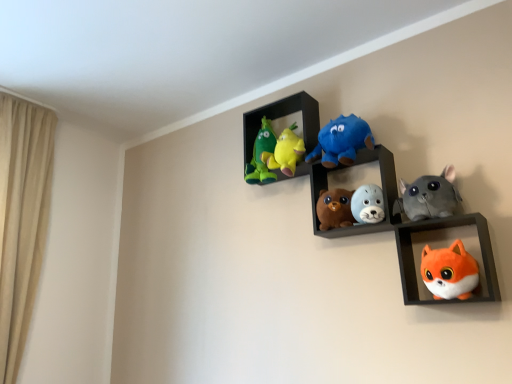
The width and height of the screenshot is (512, 384). I want to click on fluffy gray seal at center, the 3th toy positioned from the right, so click(x=368, y=204).

Identify the location of green plush toy at upper left, the first toy viewed from the left. Image resolution: width=512 pixels, height=384 pixels. (262, 155).

What is the approximate width of blue plush toy at center, which is the fourth toy in right-to-left order?

The width of blue plush toy at center, which is the fourth toy in right-to-left order, is 6.03 inches.

What is the approximate height of soft plush toys at center, arranged as the second shelf when viewed from the front?

soft plush toys at center, arranged as the second shelf when viewed from the front, is 10.71 inches in height.

You are a GUI agent. You are given a task and a screenshot of the screen. Output one action in this format:
    pyautogui.click(x=<x>, y=<y>)
    Task: Click on the velvet plush toys at upper center
    Image resolution: width=512 pixels, height=384 pixels.
    Given the screenshot: What is the action you would take?
    pyautogui.click(x=283, y=116)

Locate an element on the screen. The height and width of the screenshot is (384, 512). gray plush cat at upper right, the 5th toy positioned from the left is located at coordinates (428, 196).

Find the location of a particular element. This screenshot has width=512, height=384. fluffy gray seal at center, placed as the fourth toy when sorted from left to right is located at coordinates 368,204.

Which object is wider, fluffy gray seal at center, the 3th toy positioned from the right, or beige fabric curtain at left?

beige fabric curtain at left.

Is fluffy gray seal at center, placed as the fourth toy when sorted from left to right, oriented towards beige fabric curtain at left?

No, fluffy gray seal at center, placed as the fourth toy when sorted from left to right, is not facing towards beige fabric curtain at left.

Can you confirm if fluffy gray seal at center, the 3th toy positioned from the right, is bigger than beige fabric curtain at left?

Actually, fluffy gray seal at center, the 3th toy positioned from the right, might be smaller than beige fabric curtain at left.

From a real-world perspective, which is physically below, fluffy gray seal at center, the 3th toy positioned from the right, or beige fabric curtain at left?

fluffy gray seal at center, the 3th toy positioned from the right.

Can you confirm if gray plush cat at upper right, which is the second toy from right to left, is shorter than blue plush toy at center, which is the fourth toy in right-to-left order?

Indeed, gray plush cat at upper right, which is the second toy from right to left, has a lesser height compared to blue plush toy at center, which is the fourth toy in right-to-left order.

In the scene shown: Is gray plush cat at upper right, the 5th toy positioned from the left, completely or partially outside of blue plush toy at center, the 3th toy when ordered from left to right?

gray plush cat at upper right, the 5th toy positioned from the left, lies outside blue plush toy at center, the 3th toy when ordered from left to right,'s area.

Which object is closer to the camera, gray plush cat at upper right, which is the second toy from right to left, or blue plush toy at center, the 3th toy when ordered from left to right?

gray plush cat at upper right, which is the second toy from right to left, is closer to the camera.

Is blue plush toy at center, the 3th toy when ordered from left to right, at the back of gray plush cat at upper right, which is the second toy from right to left?

No, gray plush cat at upper right, which is the second toy from right to left,'s orientation is not away from blue plush toy at center, the 3th toy when ordered from left to right.

Between beige fabric curtain at left and brown plush bear at center, which appears as the 2th toy when viewed from the left, which one has less height?

With less height is brown plush bear at center, which appears as the 2th toy when viewed from the left.

Which of these two, beige fabric curtain at left or brown plush bear at center, the fifth toy viewed from the right, is thinner?

brown plush bear at center, the fifth toy viewed from the right.

Does beige fabric curtain at left turn towards brown plush bear at center, the fifth toy viewed from the right?

No, beige fabric curtain at left is not aimed at brown plush bear at center, the fifth toy viewed from the right.

Which toy is the 2nd one when counting from the right side of the beige fabric curtain at left? Please provide its 2D coordinates.

[(334, 209)]

Is velvet plush toys at upper center shorter than fluffy gray seal at center, the 3th toy positioned from the right?

Incorrect, the height of velvet plush toys at upper center does not fall short of that of fluffy gray seal at center, the 3th toy positioned from the right.

Could you tell me if velvet plush toys at upper center is facing fluffy gray seal at center, placed as the fourth toy when sorted from left to right?

No, velvet plush toys at upper center does not turn towards fluffy gray seal at center, placed as the fourth toy when sorted from left to right.

Looking at this image, can you confirm if velvet plush toys at upper center is wider than fluffy gray seal at center, the 3th toy positioned from the right?

Incorrect, the width of velvet plush toys at upper center does not surpass that of fluffy gray seal at center, the 3th toy positioned from the right.

From a real-world perspective, which object rests below the other?

fluffy gray seal at center, the 3th toy positioned from the right, from a real-world perspective.

How many degrees apart are the facing directions of orange plush fox at lower right, the second shelf positioned from the back, and green plush toy at upper left, the first toy viewed from the left?

The facing directions of orange plush fox at lower right, the second shelf positioned from the back, and green plush toy at upper left, the first toy viewed from the left, are 2.18 degrees apart.

Between orange plush fox at lower right, which is the 1th shelf from front to back, and green plush toy at upper left, acting as the sixth toy starting from the right, which one appears on the left side from the viewer's perspective?

From the viewer's perspective, green plush toy at upper left, acting as the sixth toy starting from the right, appears more on the left side.

Is orange plush fox at lower right, which is the 1th shelf from front to back, further to the viewer compared to green plush toy at upper left, the first toy viewed from the left?

No, it is not.

From a real-world perspective, is orange plush fox at lower right, which is the 1th shelf from front to back, over green plush toy at upper left, acting as the sixth toy starting from the right?

No, from a real-world perspective, orange plush fox at lower right, which is the 1th shelf from front to back, is not over green plush toy at upper left, acting as the sixth toy starting from the right

From a real-world perspective, is soft plush toys at center, arranged as the second shelf when viewed from the front, physically above fluffy gray seal at center, the 3th toy positioned from the right?

Yes, from a real-world perspective, soft plush toys at center, arranged as the second shelf when viewed from the front, is above fluffy gray seal at center, the 3th toy positioned from the right.

Can you confirm if soft plush toys at center, which appears as the 1th shelf when viewed from the back, is smaller than fluffy gray seal at center, placed as the fourth toy when sorted from left to right?

Actually, soft plush toys at center, which appears as the 1th shelf when viewed from the back, might be larger than fluffy gray seal at center, placed as the fourth toy when sorted from left to right.

Which of these two, soft plush toys at center, arranged as the second shelf when viewed from the front, or fluffy gray seal at center, placed as the fourth toy when sorted from left to right, stands taller?

soft plush toys at center, arranged as the second shelf when viewed from the front.

Does point (372, 229) appear closer or farther from the camera than point (374, 198)?

Clearly, point (372, 229) is more distant from the camera than point (374, 198).

Is point (475, 245) farther from camera compared to point (314, 209)?

No, (475, 245) is closer to viewer.

Considering the sizes of objects orange plush fox at lower right, the second shelf positioned from the back, and soft plush toys at center, arranged as the second shelf when viewed from the front, in the image provided, who is bigger, orange plush fox at lower right, the second shelf positioned from the back, or soft plush toys at center, arranged as the second shelf when viewed from the front,?

orange plush fox at lower right, the second shelf positioned from the back, is bigger.

Could you tell me if orange plush fox at lower right, the second shelf positioned from the back, is turned towards soft plush toys at center, arranged as the second shelf when viewed from the front?

No, orange plush fox at lower right, the second shelf positioned from the back, is not turned towards soft plush toys at center, arranged as the second shelf when viewed from the front.

Is orange plush fox at lower right, which is the 1th shelf from front to back, outside of soft plush toys at center, arranged as the second shelf when viewed from the front?

That's correct, orange plush fox at lower right, which is the 1th shelf from front to back, is outside of soft plush toys at center, arranged as the second shelf when viewed from the front.

Starting from the beige fabric curtain at left, which toy is the 4th one to the right? Please provide its 2D coordinates.

[(368, 204)]

Where is `the 2nd toy positioned above the gray plush cat at upper right, which is the second toy from right to left (from a real-world perspective)`? Image resolution: width=512 pixels, height=384 pixels. the 2nd toy positioned above the gray plush cat at upper right, which is the second toy from right to left (from a real-world perspective) is located at coordinates (342, 141).

When comparing their distances from fluffy gray seal at center, the 3th toy positioned from the right, does beige fabric curtain at left or orange plush fox at lower right, the second shelf positioned from the back, seem closer?

orange plush fox at lower right, the second shelf positioned from the back, is positioned closer to the anchor fluffy gray seal at center, the 3th toy positioned from the right.

Looking at the image, which one is located closer to orange plush fox at lower right, which is the 1th shelf from front to back, orange plush toy at lower right, the first toy in the right-to-left sequence, or brown plush bear at center, which appears as the 2th toy when viewed from the left?

The object closer to orange plush fox at lower right, which is the 1th shelf from front to back, is orange plush toy at lower right, the first toy in the right-to-left sequence.

Based on their spatial positions, is fluffy gray seal at center, the 3th toy positioned from the right, or blue plush toy at center, which is the fourth toy in right-to-left order, closer to brown plush bear at center, the fifth toy viewed from the right?

fluffy gray seal at center, the 3th toy positioned from the right.

Based on their spatial positions, is orange plush toy at lower right, the sixth toy viewed from the left, or green plush toy at upper left, the first toy viewed from the left, further from velvet plush toys at upper center?

orange plush toy at lower right, the sixth toy viewed from the left.

Estimate the real-world distances between objects in this image. Which object is closer to blue plush toy at center, the 3th toy when ordered from left to right, gray plush cat at upper right, which is the second toy from right to left, or orange plush fox at lower right, which is the 1th shelf from front to back?

gray plush cat at upper right, which is the second toy from right to left, is closer to blue plush toy at center, the 3th toy when ordered from left to right.

From the image, which object appears to be farther from gray plush cat at upper right, which is the second toy from right to left, green plush toy at upper left, acting as the sixth toy starting from the right, or orange plush toy at lower right, the sixth toy viewed from the left?

Based on the image, green plush toy at upper left, acting as the sixth toy starting from the right, appears to be further to gray plush cat at upper right, which is the second toy from right to left.

Consider the image. Which object lies nearer to the anchor point blue plush toy at center, which is the fourth toy in right-to-left order, green plush toy at upper left, acting as the sixth toy starting from the right, or beige fabric curtain at left?

green plush toy at upper left, acting as the sixth toy starting from the right, is positioned closer to the anchor blue plush toy at center, which is the fourth toy in right-to-left order.

Based on their spatial positions, is brown plush bear at center, the fifth toy viewed from the right, or orange plush toy at lower right, the first toy in the right-to-left sequence, closer to velvet plush toys at upper center?

brown plush bear at center, the fifth toy viewed from the right, lies closer to velvet plush toys at upper center than the other object.

At what (x,y) coordinates should I click in order to perform the action: click on cabinet situated between beige fabric curtain at left and orange plush toy at lower right, the sixth toy viewed from the left, from left to right. Please return your answer as a coordinate pair (x, y). Looking at the image, I should click on (283, 116).

At what (x,y) coordinates should I click in order to perform the action: click on cabinet situated between beige fabric curtain at left and orange plush fox at lower right, which is the 1th shelf from front to back, from left to right. Please return your answer as a coordinate pair (x, y). Looking at the image, I should click on (283, 116).

The width and height of the screenshot is (512, 384). I want to click on shelf between blue plush toy at center, which is the fourth toy in right-to-left order, and brown plush bear at center, which appears as the 2th toy when viewed from the left, in the up-down direction, so click(349, 179).

Locate an element on the screen. cabinet between beige fabric curtain at left and blue plush toy at center, which is the fourth toy in right-to-left order, from left to right is located at coordinates (283, 116).